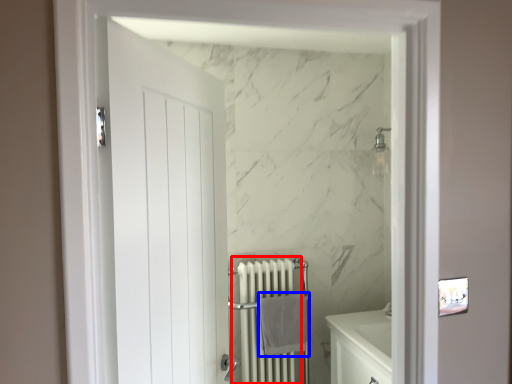
Question: Which point is closer to the camera, radiator (highlighted by a red box) or bath towel (highlighted by a blue box)?

Choices:
 (A) radiator
 (B) bath towel

Answer: (A)